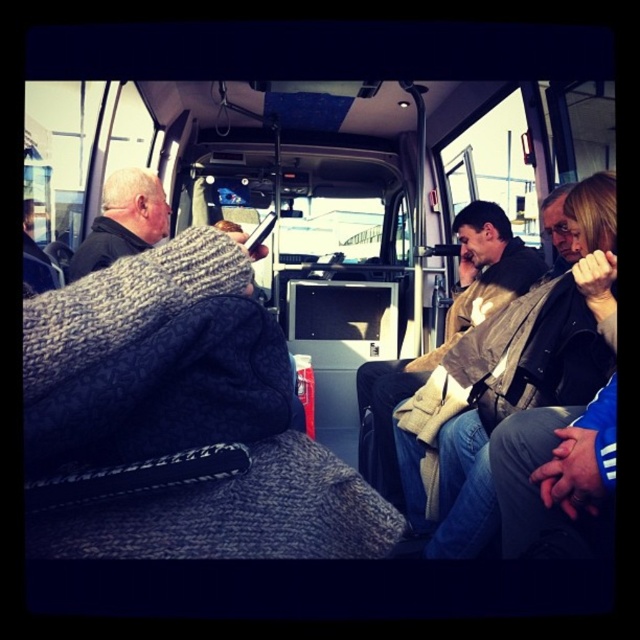
Question: Does brown leather jacket at center have a lesser width compared to dark gray knit sweater at left?

Choices:
 (A) yes
 (B) no

Answer: (B)

Question: Which object appears farthest from the camera in this image?

Choices:
 (A) black plastic phone at center
 (B) dark gray knit sweater at left
 (C) matte black jacket at upper left

Answer: (B)

Question: Which point is closer to the camera taking this photo?

Choices:
 (A) (250, 237)
 (B) (588, 348)
 (C) (378, 458)

Answer: (A)

Question: Does matte black jacket at upper left appear under leather jacket at right?

Choices:
 (A) yes
 (B) no

Answer: (A)

Question: Can you confirm if brown leather jacket at center is smaller than dark gray knit sweater at left?

Choices:
 (A) yes
 (B) no

Answer: (B)

Question: Which of the following is the closest to the observer?

Choices:
 (A) matte black jacket at upper left
 (B) dark gray knit sweater at left

Answer: (A)